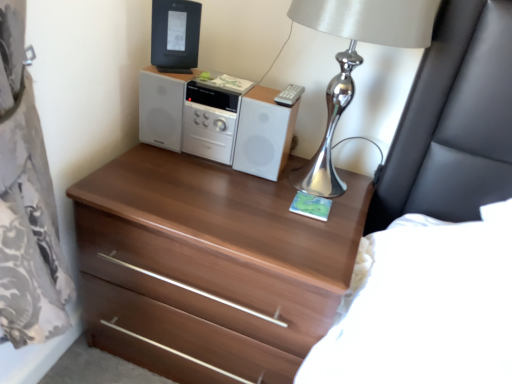
Identify the location of vacant space situated above walnut wood chest of drawers at center (from a real-world perspective). The height and width of the screenshot is (384, 512). (242, 195).